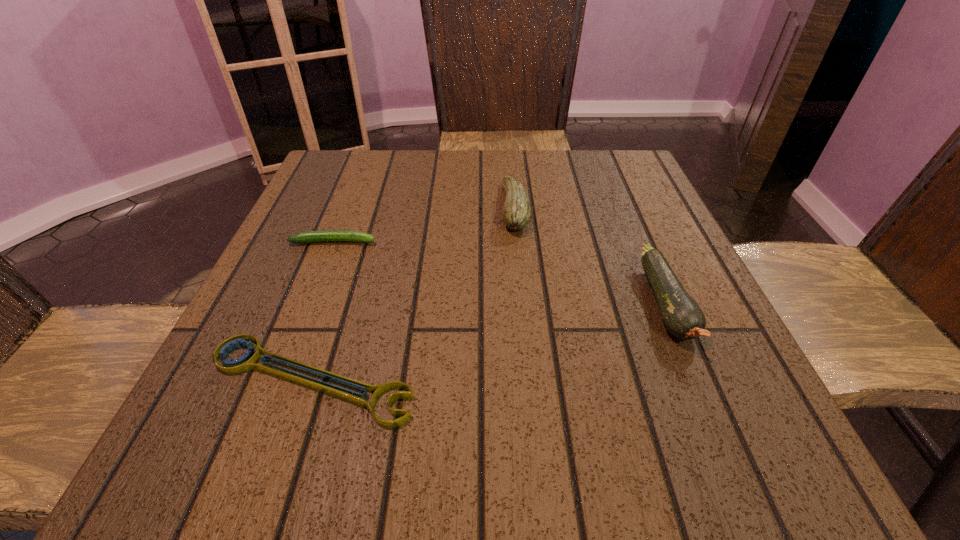
Locate an element on the screen. The width and height of the screenshot is (960, 540). the rightmost object is located at coordinates (682, 316).

The height and width of the screenshot is (540, 960). Identify the location of the nearest zucchini. (682, 316).

Locate an element on the screen. Image resolution: width=960 pixels, height=540 pixels. the second object from right to left is located at coordinates (516, 214).

Identify the location of the farthest zucchini. Image resolution: width=960 pixels, height=540 pixels. (516, 214).

Where is `the leftmost zucchini`? Image resolution: width=960 pixels, height=540 pixels. the leftmost zucchini is located at coordinates (329, 235).

Find the location of `the second farthest zucchini`. the second farthest zucchini is located at coordinates (329, 235).

This screenshot has width=960, height=540. I want to click on the shortest object, so click(x=248, y=361).

Where is `free space located at the blossom end of the nearest zucchini`? free space located at the blossom end of the nearest zucchini is located at coordinates (732, 461).

Where is `vacant space located 0.280m at the stem end of the farthest object`? Image resolution: width=960 pixels, height=540 pixels. vacant space located 0.280m at the stem end of the farthest object is located at coordinates (372, 208).

This screenshot has height=540, width=960. Identify the location of vacant space situated at the stem end of the farthest object. (473, 208).